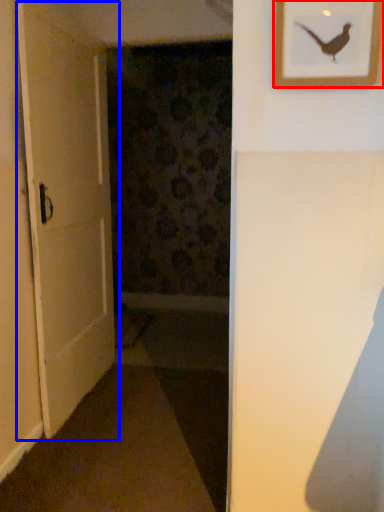
Question: Among these objects, which one is nearest to the camera, picture frame (highlighted by a red box) or door (highlighted by a blue box)?

Choices:
 (A) picture frame
 (B) door

Answer: (A)